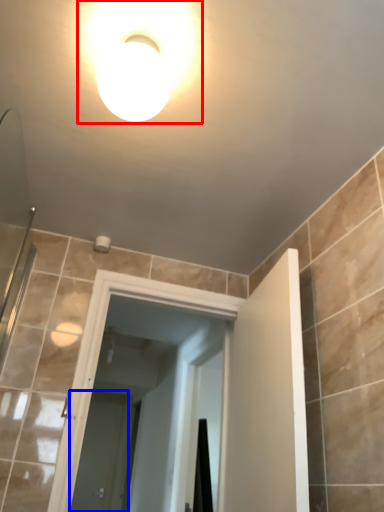
Question: Which point is closer to the camera, light fixture (highlighted by a red box) or screen door (highlighted by a blue box)?

Choices:
 (A) light fixture
 (B) screen door

Answer: (A)